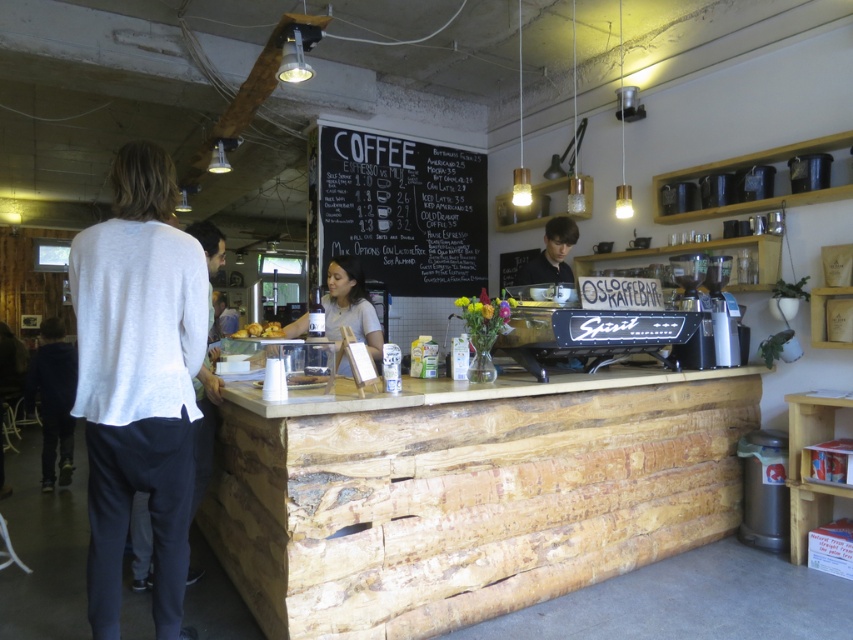
Question: Estimate the real-world distances between objects in this image. Which object is closer to the matte black wine bottle at center?

Choices:
 (A) white cotton sweater at left
 (B) natural wood counter at center
 (C) golden brown pastry at center
 (D) smooth black shirt at center

Answer: (C)

Question: Which is farther from the golden brown pastry at center?

Choices:
 (A) black chalkboard at center
 (B) natural wood counter at center
 (C) matte black wine bottle at center

Answer: (A)

Question: Does natural wood counter at center have a greater width compared to black chalkboard at center?

Choices:
 (A) no
 (B) yes

Answer: (B)

Question: Which object is closer to the camera taking this photo?

Choices:
 (A) smooth black shirt at center
 (B) golden brown pastry at center
 (C) matte black wine bottle at center
 (D) white matte sweater at left

Answer: (D)

Question: Can you confirm if smooth black shirt at center is positioned to the left of golden brown pastry at center?

Choices:
 (A) yes
 (B) no

Answer: (B)

Question: Where is white matte sweater at left located in relation to golden brown pastry at center in the image?

Choices:
 (A) right
 (B) left

Answer: (B)